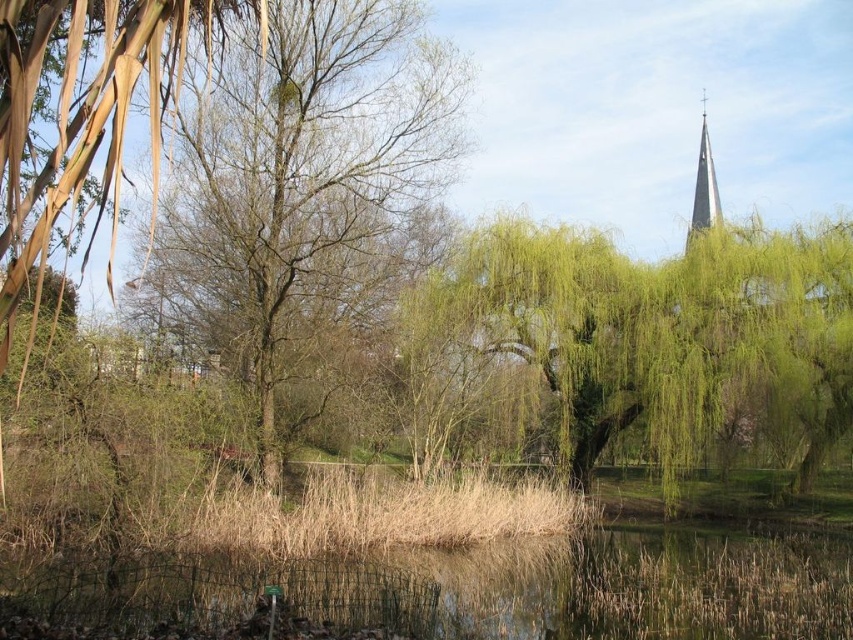
Question: Does green leafy willow at center appear on the left side of smooth gray steeple at upper right?

Choices:
 (A) no
 (B) yes

Answer: (B)

Question: Among these points, which one is farthest from the camera?

Choices:
 (A) (256, 522)
 (B) (413, 608)
 (C) (699, 157)
 (D) (846, 330)

Answer: (C)

Question: Estimate the real-world distances between objects in this image. Which object is closer to the dry grass at center?

Choices:
 (A) bare branches at center
 (B) green grassy water at lower center

Answer: (B)

Question: Considering the relative positions of dry grass at center and smooth gray steeple at upper right in the image provided, where is dry grass at center located with respect to smooth gray steeple at upper right?

Choices:
 (A) right
 (B) left

Answer: (B)

Question: Estimate the real-world distances between objects in this image. Which object is farther from the green leafy willow at center?

Choices:
 (A) dry grass at center
 (B) smooth gray steeple at upper right

Answer: (B)

Question: Can you confirm if green grassy water at lower center is bigger than smooth gray steeple at upper right?

Choices:
 (A) yes
 (B) no

Answer: (A)